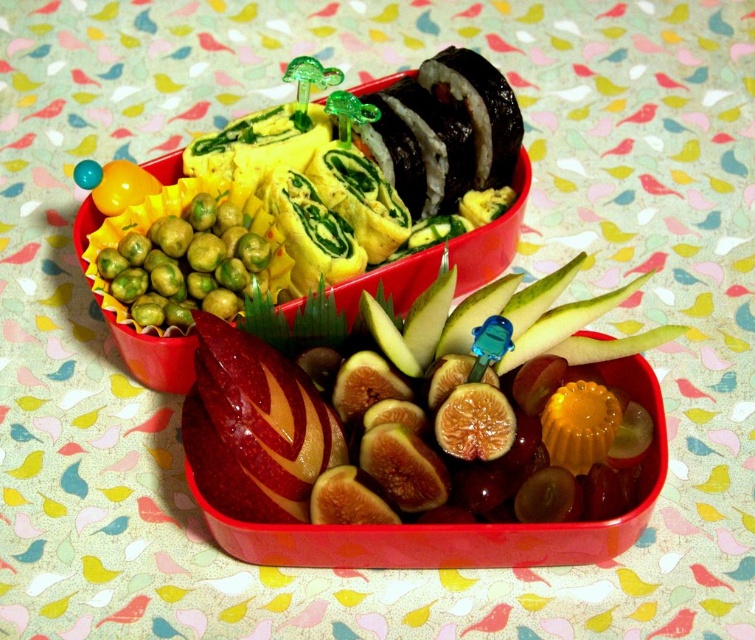
Question: Where is shiny red apple at center located in relation to green matte peas at upper left in the image?

Choices:
 (A) below
 (B) above

Answer: (A)

Question: Which point is farther from the camera taking this photo?

Choices:
 (A) (174, 220)
 (B) (507, 337)

Answer: (A)

Question: Which point is farther to the camera?

Choices:
 (A) (214, 294)
 (B) (214, 380)

Answer: (A)

Question: Does shiny red apple at center appear on the left side of green matte peas at upper left?

Choices:
 (A) no
 (B) yes

Answer: (A)

Question: Can you confirm if shiny red apple at center is positioned to the right of green matte peas at upper left?

Choices:
 (A) no
 (B) yes

Answer: (B)